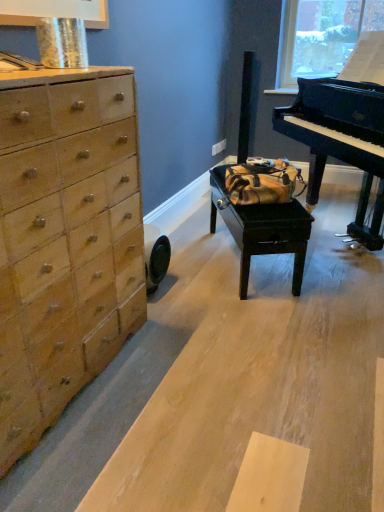
Consider the image. In order to face light brown wood chest of drawers at left, should I rotate leftwards or rightwards?

Turn left by 20.545 degrees to look at light brown wood chest of drawers at left.

The image size is (384, 512). Identify the location of natural wood plywood at lower left. click(263, 385).

Could you tell me if natural wood plywood at lower left is turned towards light brown wood chest of drawers at left?

No, natural wood plywood at lower left does not turn towards light brown wood chest of drawers at left.

From a real-world perspective, is natural wood plywood at lower left above or below light brown wood chest of drawers at left?

In terms of real-world spatial position, natural wood plywood at lower left is below light brown wood chest of drawers at left.

Considering the positions of objects natural wood plywood at lower left and light brown wood chest of drawers at left in the image provided, who is more to the right, natural wood plywood at lower left or light brown wood chest of drawers at left?

From the viewer's perspective, natural wood plywood at lower left appears more on the right side.

This screenshot has width=384, height=512. I want to click on chest of drawers located on the left of shiny black piano at right, so pos(65,241).

From a real-world perspective, is light brown wood chest of drawers at left above or below shiny black piano at right?

From a real-world perspective, light brown wood chest of drawers at left is physically below shiny black piano at right.

Is light brown wood chest of drawers at left oriented towards shiny black piano at right?

No, light brown wood chest of drawers at left does not turn towards shiny black piano at right.

Would you say light brown wood chest of drawers at left is a long distance from shiny black piano at right?

Yes, light brown wood chest of drawers at left is far from shiny black piano at right.

Considering the positions of points (227, 226) and (89, 266), is point (227, 226) farther from camera compared to point (89, 266)?

Yes, it is.

Does wooden table at center appear on the right side of light brown wood chest of drawers at left?

Indeed, wooden table at center is positioned on the right side of light brown wood chest of drawers at left.

Where is `the chest of drawers located above the wooden table at center (from a real-world perspective)`? This screenshot has height=512, width=384. the chest of drawers located above the wooden table at center (from a real-world perspective) is located at coordinates (65, 241).

Which of these two, wooden table at center or light brown wood chest of drawers at left, stands shorter?

Standing shorter between the two is wooden table at center.

Does point (34, 438) come closer to viewer compared to point (237, 205)?

That is True.

From the image's perspective, is light brown wood chest of drawers at left located above or below wooden table at center?

Clearly, from the image's perspective, light brown wood chest of drawers at left is below wooden table at center.

Does light brown wood chest of drawers at left have a larger size compared to wooden table at center?

Correct, light brown wood chest of drawers at left is larger in size than wooden table at center.

Where is `the chest of drawers that appears below the wooden table at center (from the image's perspective)`? This screenshot has height=512, width=384. the chest of drawers that appears below the wooden table at center (from the image's perspective) is located at coordinates (65, 241).

From the image's perspective, is shiny black piano at right located above or below natural wood plywood at lower left?

shiny black piano at right is above natural wood plywood at lower left.

Considering the positions of objects shiny black piano at right and natural wood plywood at lower left in the image provided, who is more to the left, shiny black piano at right or natural wood plywood at lower left?

From the viewer's perspective, natural wood plywood at lower left appears more on the left side.

Is shiny black piano at right positioned with its back to natural wood plywood at lower left?

shiny black piano at right is not turned away from natural wood plywood at lower left.

Could you tell me if shiny black piano at right is facing light brown wood chest of drawers at left?

Yes, shiny black piano at right is facing light brown wood chest of drawers at left.

Is there a large distance between shiny black piano at right and light brown wood chest of drawers at left?

Yes, shiny black piano at right and light brown wood chest of drawers at left are located far from each other.

Considering the relative sizes of shiny black piano at right and light brown wood chest of drawers at left in the image provided, is shiny black piano at right bigger than light brown wood chest of drawers at left?

Yes.

Find the location of a particular element. The image size is (384, 512). chest of drawers lying on the left of shiny black piano at right is located at coordinates (65, 241).

Is natural wood plywood at lower left oriented away from wooden table at center?

No, natural wood plywood at lower left is not facing away from wooden table at center.

Is natural wood plywood at lower left not near wooden table at center?

No, there isn't a large distance between natural wood plywood at lower left and wooden table at center.

Is wooden table at center inside natural wood plywood at lower left?

No, wooden table at center is not inside natural wood plywood at lower left.

Which point is more distant from viewer, [336,392] or [297,218]?

Positioned behind is point [297,218].

At what (x,y) coordinates should I click in order to perform the action: click on the chest of drawers located above the natural wood plywood at lower left (from a real-world perspective). Please return your answer as a coordinate pair (x, y). This screenshot has height=512, width=384. Looking at the image, I should click on tap(65, 241).

Image resolution: width=384 pixels, height=512 pixels. I want to click on the chest of drawers located underneath the shiny black piano at right (from a real-world perspective), so click(65, 241).

Based on their spatial positions, is natural wood plywood at lower left or light brown wood chest of drawers at left further from shiny black piano at right?

light brown wood chest of drawers at left is positioned further to the anchor shiny black piano at right.

Looking at the image, which one is located further to shiny black piano at right, natural wood plywood at lower left or wooden table at center?

Among the two, natural wood plywood at lower left is located further to shiny black piano at right.

In the scene shown: Considering their positions, is shiny black piano at right positioned closer to natural wood plywood at lower left than wooden table at center?

wooden table at center is closer to natural wood plywood at lower left.

Based on their spatial positions, is light brown wood chest of drawers at left or natural wood plywood at lower left closer to shiny black piano at right?

natural wood plywood at lower left is closer to shiny black piano at right.

From the picture: From the image, which object appears to be farther from light brown wood chest of drawers at left, natural wood plywood at lower left or shiny black piano at right?

Based on the image, shiny black piano at right appears to be further to light brown wood chest of drawers at left.

From the image, which object appears to be farther from shiny black piano at right, light brown wood chest of drawers at left or wooden table at center?

Based on the image, light brown wood chest of drawers at left appears to be further to shiny black piano at right.

Considering their positions, is natural wood plywood at lower left positioned further to wooden table at center than shiny black piano at right?

Based on the image, shiny black piano at right appears to be further to wooden table at center.

Considering their positions, is wooden table at center positioned closer to natural wood plywood at lower left than light brown wood chest of drawers at left?

wooden table at center lies closer to natural wood plywood at lower left than the other object.

Locate an element on the screen. plywood positioned between light brown wood chest of drawers at left and wooden table at center from near to far is located at coordinates (263, 385).

Locate an element on the screen. plywood between light brown wood chest of drawers at left and shiny black piano at right is located at coordinates (263, 385).

Locate an element on the screen. The image size is (384, 512). piano between natural wood plywood at lower left and wooden table at center along the z-axis is located at coordinates (344, 129).

What are the coordinates of `table between light brown wood chest of drawers at left and shiny black piano at right from left to right` in the screenshot? It's located at (270, 236).